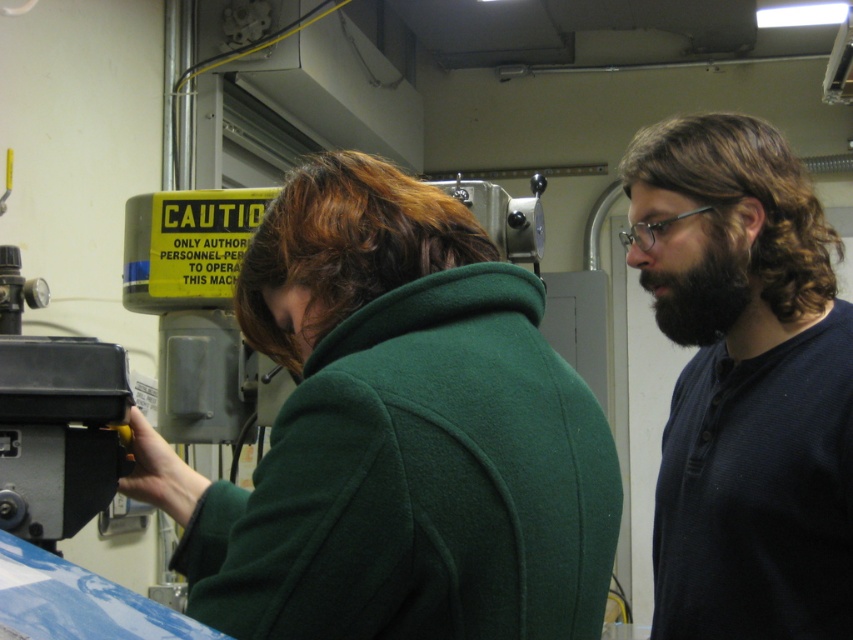
You are a safety inspector in this industrial setting. You need to ensure that the green woolen coat at center and the black fuzzy beard at right are compliant with the safety regulations. According to the scene description, which object is larger and might pose a risk if it interferes with machinery?

The green woolen coat at center is larger than the black fuzzy beard at right, so it might pose a greater risk if it interferes with machinery due to its size.

You are an inspector in this industrial setting. You need to locate the green woolen coat at center. Where exactly is it positioned in the image using coordinates?

The green woolen coat at center is located at coordinates point (397, 435).